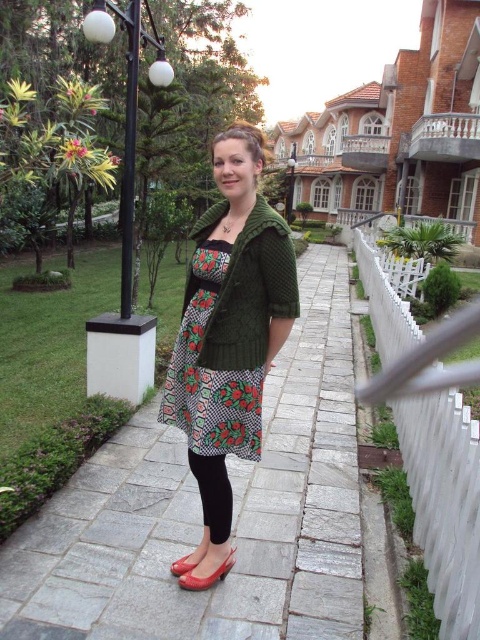
Looking at this image, you are a fashion designer who wants to take a photo of the green knitted sweater at center. Where should you position your camera to capture it best?

The green knitted sweater at center is located at point [228,332], so you should position your camera directly facing this coordinate to capture it best.

You are a fashion designer observing the person in the image. You need to determine if the green knitted sweater at center can be worn over the green knitted jacket at center without looking bulky. Which item is wider?

The green knitted sweater at center is wider than the green knitted jacket at center, so wearing the sweater over the jacket may appear bulky.